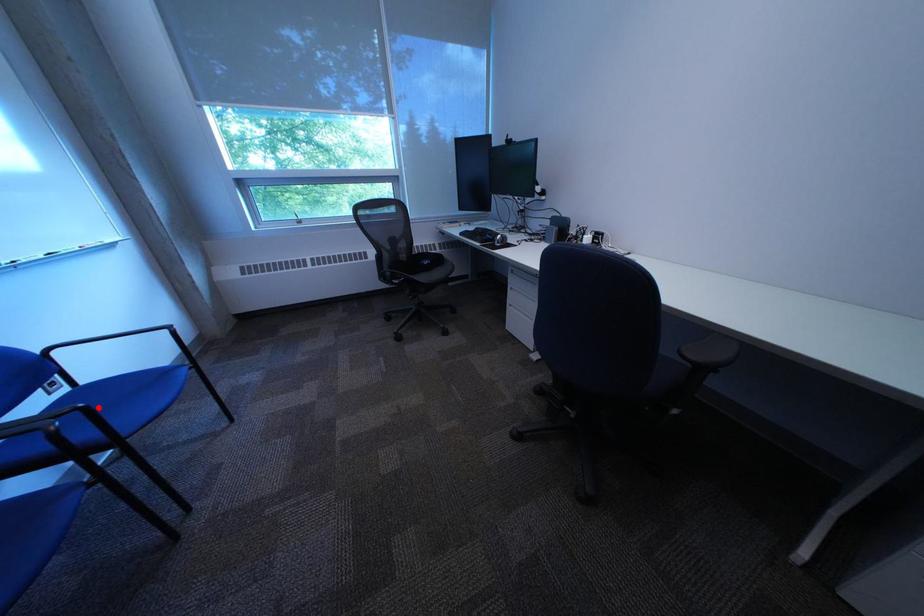
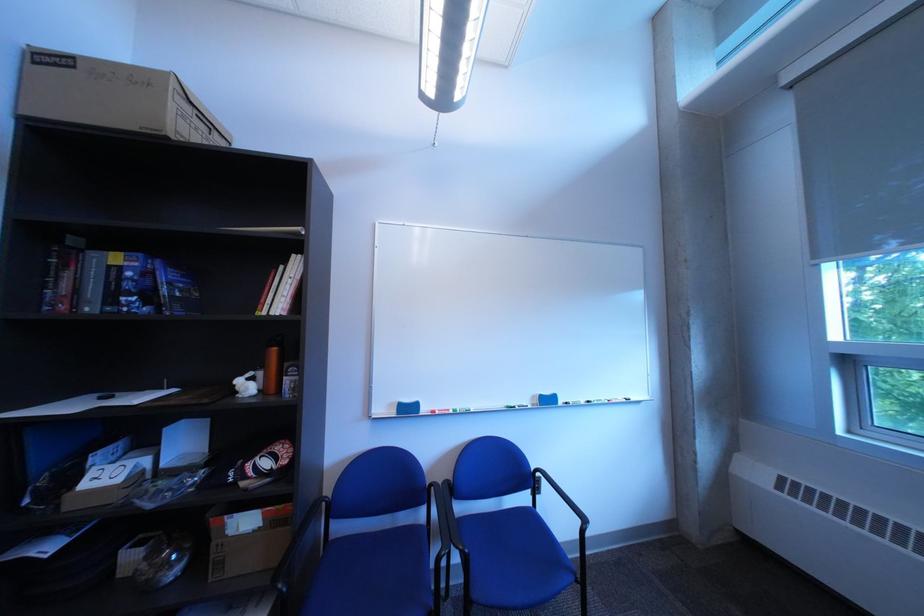
Question: I am providing you with two images of the same scene from different viewpoints. Given a red point in image1, look at the same physical point in image2. Is it:

Choices:
 (A) Closer to the viewpoint
 (B) Farther from the viewpoint

Answer: (A)